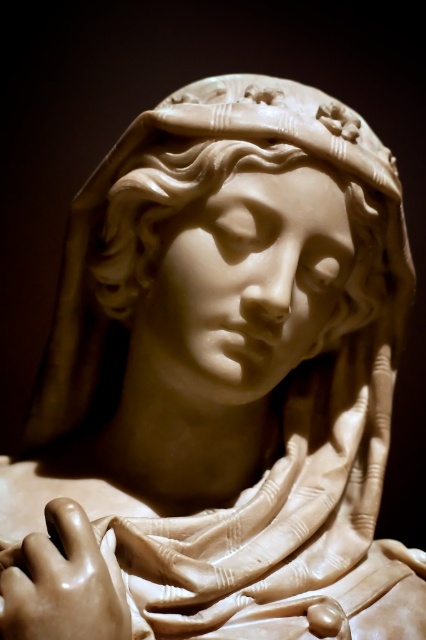
Consider the image. You are an art conservator examining the sculpture. You need to apply a protective coating to the area at point coordinates point (247, 170). Where exactly on the sculpture should you apply the coating?

The matte white sculpture at center is located at point (247, 170), so you should apply the protective coating to the center of the matte white sculpture at center.

From the picture: You are standing 1.5 meters away from the sculpture. There is a point at coordinates point (x=204, y=113) on the sculpture. Can you reach this point without moving closer to the sculpture?

The distance of point (x=204, y=113) from camera is 1.03 meters. Since you are standing 1.5 meters away from the sculpture, the point is 0.47 meters closer than your current position. Therefore, you cannot reach the point without moving closer to the sculpture.

You are an art conservator examining a classical marble sculpture. You notice the matte white sculpture at center and the matte beige hand at lower left in the image. From the perspective of someone standing in front of the artwork, which object is positioned higher?

The matte white sculpture at center is located above the matte beige hand at lower left, so it is positioned higher.